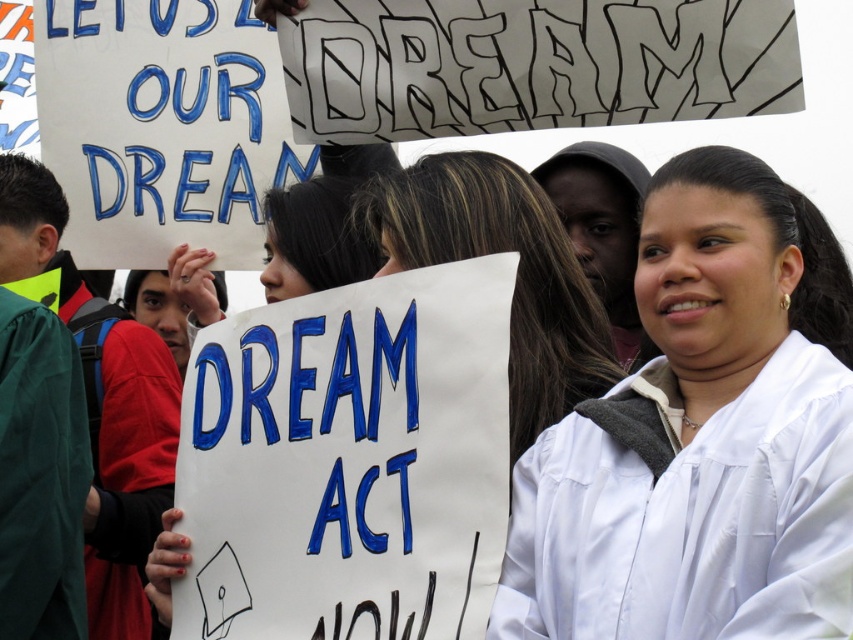
Question: Which of the following is the closest to the observer?

Choices:
 (A) white satin graduation gown at center
 (B) white matte graduation gown at center

Answer: (A)

Question: Does white satin graduation gown at center appear over white matte graduation gown at center?

Choices:
 (A) yes
 (B) no

Answer: (B)

Question: Considering the relative positions of white satin graduation gown at center and white matte graduation gown at center in the image provided, where is white satin graduation gown at center located with respect to white matte graduation gown at center?

Choices:
 (A) left
 (B) right

Answer: (B)

Question: Is white satin graduation gown at center to the left of white matte graduation gown at center from the viewer's perspective?

Choices:
 (A) no
 (B) yes

Answer: (A)

Question: Among these objects, which one is nearest to the camera?

Choices:
 (A) white satin graduation gown at center
 (B) white matte graduation gown at center

Answer: (A)